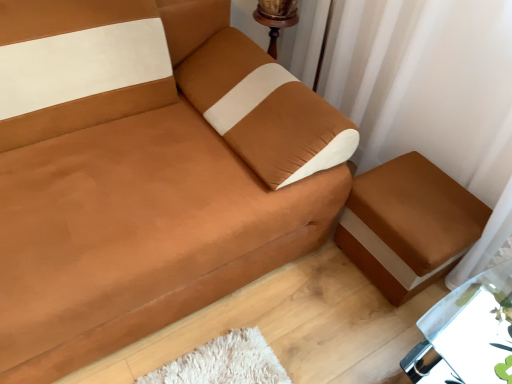
Question: Considering the relative positions of suede-like brown couch at center and metallic silver table at lower right in the image provided, is suede-like brown couch at center to the left of metallic silver table at lower right from the viewer's perspective?

Choices:
 (A) yes
 (B) no

Answer: (A)

Question: Does suede-like brown couch at center have a larger size compared to metallic silver table at lower right?

Choices:
 (A) yes
 (B) no

Answer: (A)

Question: Is suede-like brown couch at center closer to camera compared to metallic silver table at lower right?

Choices:
 (A) yes
 (B) no

Answer: (A)

Question: Does suede-like brown couch at center have a greater height compared to metallic silver table at lower right?

Choices:
 (A) no
 (B) yes

Answer: (B)

Question: Does suede-like brown couch at center contain metallic silver table at lower right?

Choices:
 (A) yes
 (B) no

Answer: (B)

Question: Is metallic silver table at lower right to the left or to the right of brown fabric ottoman at lower right in the image?

Choices:
 (A) right
 (B) left

Answer: (A)

Question: Is point (496, 337) positioned closer to the camera than point (378, 264)?

Choices:
 (A) farther
 (B) closer

Answer: (B)

Question: From the image's perspective, is metallic silver table at lower right positioned above or below brown fabric ottoman at lower right?

Choices:
 (A) above
 (B) below

Answer: (B)

Question: In the image, is metallic silver table at lower right positioned in front of or behind brown fabric ottoman at lower right?

Choices:
 (A) behind
 (B) front

Answer: (B)

Question: From the image's perspective, is white sheer curtain at upper right above or below brown fabric ottoman at lower right?

Choices:
 (A) below
 (B) above

Answer: (B)

Question: From a real-world perspective, is white sheer curtain at upper right physically located above or below brown fabric ottoman at lower right?

Choices:
 (A) below
 (B) above

Answer: (B)

Question: Does point (392, 145) appear closer or farther from the camera than point (380, 246)?

Choices:
 (A) closer
 (B) farther

Answer: (B)

Question: Is white sheer curtain at upper right bigger or smaller than brown fabric ottoman at lower right?

Choices:
 (A) big
 (B) small

Answer: (A)

Question: Considering the positions of point (468, 162) and point (480, 286), is point (468, 162) closer or farther from the camera than point (480, 286)?

Choices:
 (A) farther
 (B) closer

Answer: (B)

Question: Considering the positions of white sheer curtain at upper right and metallic silver table at lower right in the image, is white sheer curtain at upper right bigger or smaller than metallic silver table at lower right?

Choices:
 (A) small
 (B) big

Answer: (B)